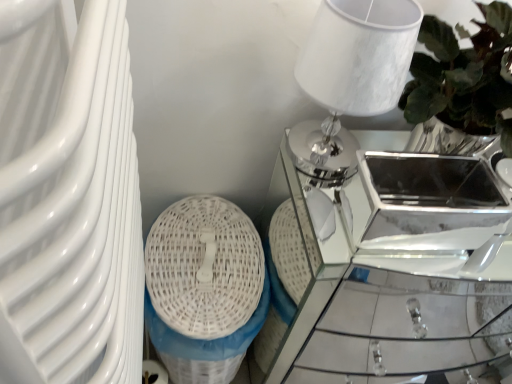
Find the location of a particular element. The width and height of the screenshot is (512, 384). vacant point above white wicker basket at lower left (from a real-world perspective) is located at coordinates (207, 256).